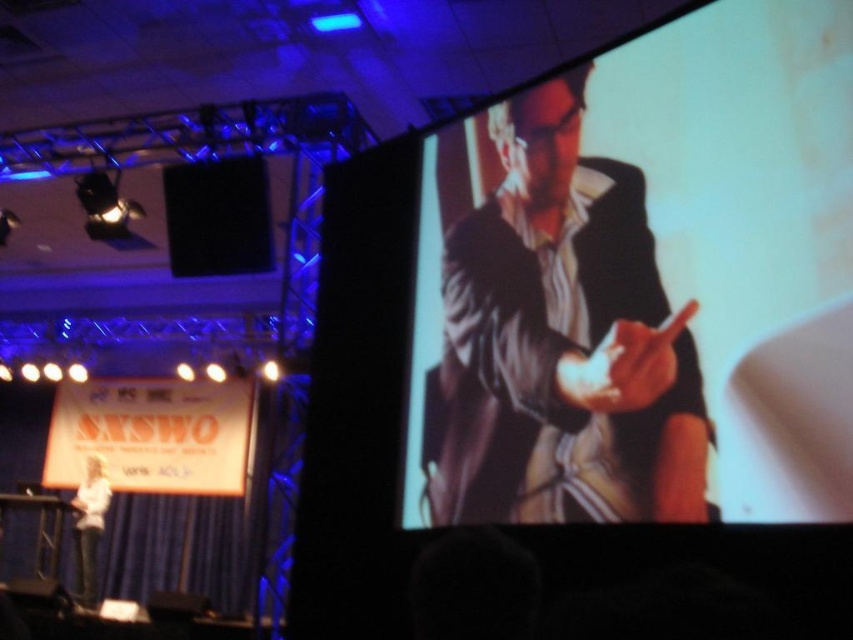
Question: Is white paper at lower left positioned at the back of black matte speaker at upper left?

Choices:
 (A) yes
 (B) no

Answer: (A)

Question: Can you confirm if matte black suit at center is positioned above white paper at lower left?

Choices:
 (A) yes
 (B) no

Answer: (A)

Question: Is matte black suit at center positioned behind white paper at lower left?

Choices:
 (A) yes
 (B) no

Answer: (B)

Question: Among these points, which one is farthest from the camera?

Choices:
 (A) (618, 388)
 (B) (167, 202)
 (C) (120, 422)

Answer: (C)

Question: Which of the following is the farthest from the observer?

Choices:
 (A) (224, 221)
 (B) (619, 490)

Answer: (A)

Question: Among these points, which one is nearest to the camera?

Choices:
 (A) (498, 324)
 (B) (213, 273)
 (C) (143, 438)

Answer: (A)